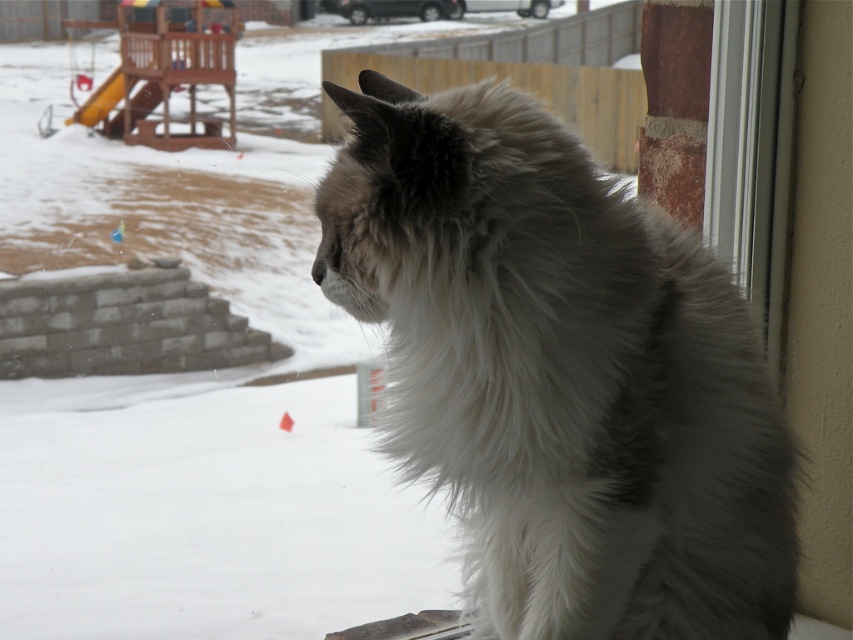
Can you confirm if white fluffy cat at right is bigger than clear glass window at upper right?

Indeed, white fluffy cat at right has a larger size compared to clear glass window at upper right.

Who is positioned more to the right, white fluffy cat at right or clear glass window at upper right?

Positioned to the right is clear glass window at upper right.

Identify the location of white fluffy cat at right. The width and height of the screenshot is (853, 640). (560, 372).